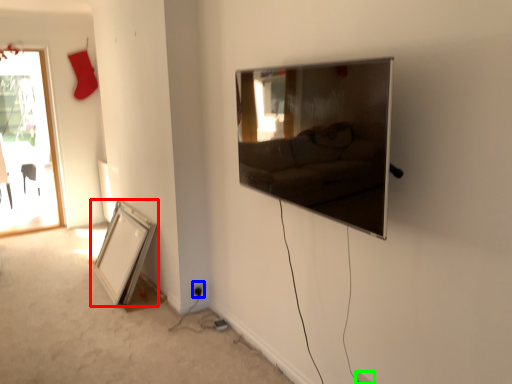
Question: Based on their relative distances, which object is nearer to picture frame (highlighted by a red box)? Choose from electric outlet (highlighted by a blue box) and electric outlet (highlighted by a green box).

Choices:
 (A) electric outlet
 (B) electric outlet

Answer: (A)